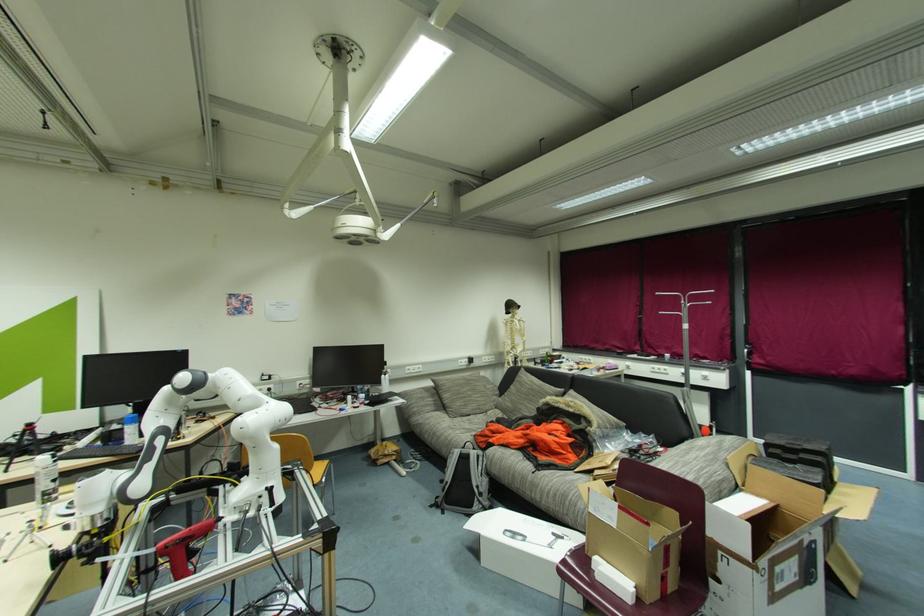
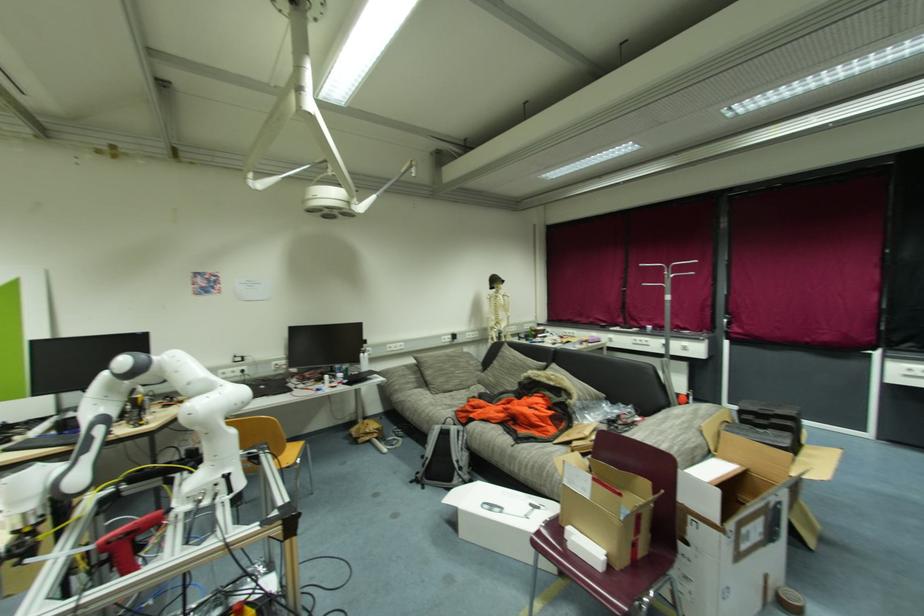
Question: The first image is from the beginning of the video and the second image is from the end. How did the camera likely rotate when shooting the video?

Choices:
 (A) Left
 (B) Right
 (C) Up
 (D) Down

Answer: (D)